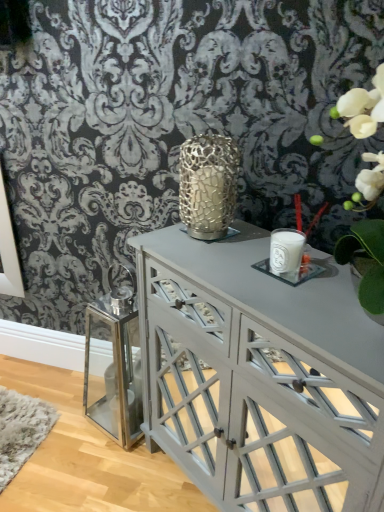
How much space does gold textured candle holder at center, arranged as the 2th candle holder when ordered from the bottom, occupy horizontally?

gold textured candle holder at center, arranged as the 2th candle holder when ordered from the bottom, is 6.56 inches in width.

In order to face white glass candle at center, the second candle holder positioned from the left, should I rotate leftwards or rightwards?

A 12.604 degree turn to the right will do.

The width and height of the screenshot is (384, 512). Describe the element at coordinates (288, 258) in the screenshot. I see `white glass candle at center, the second candle holder positioned from the left` at that location.

You are a GUI agent. You are given a task and a screenshot of the screen. Output one action in this format:
    pyautogui.click(x=<x>, y=<y>)
    Task: Click on the gold textured candle holder at center, arranged as the 2th candle holder when ordered from the bottom
    The height and width of the screenshot is (512, 384).
    Given the screenshot: What is the action you would take?
    pyautogui.click(x=208, y=185)

From a real-world perspective, is matte gray cabinet at center on white glass candle at center, the second candle holder positioned from the left?

No, from a real-world perspective, matte gray cabinet at center is not over white glass candle at center, the second candle holder positioned from the left

Locate an element on the screen. This screenshot has height=512, width=384. table located underneath the white glass candle at center, the 1th candle holder ordered from the bottom (from a real-world perspective) is located at coordinates (260, 375).

Considering the points (284, 386) and (277, 238), which point is behind, point (284, 386) or point (277, 238)?

The point (277, 238) is farther from the camera.

Is matte gray cabinet at center oriented away from white glass candle at center, marked as the 1th candle holder in a right-to-left arrangement?

matte gray cabinet at center is not turned away from white glass candle at center, marked as the 1th candle holder in a right-to-left arrangement.

How different are the orientations of white glass candle at center, the second candle holder positioned from the left, and matte gray cabinet at center in degrees?

There is a 3.14-degree angle between the facing directions of white glass candle at center, the second candle holder positioned from the left, and matte gray cabinet at center.

Is white glass candle at center, marked as the 2th candle holder in a top-to-bottom arrangement, placed right next to matte gray cabinet at center?

white glass candle at center, marked as the 2th candle holder in a top-to-bottom arrangement, and matte gray cabinet at center are not in contact.

Between white glass candle at center, the 1th candle holder ordered from the bottom, and matte gray cabinet at center, which one has larger size?

matte gray cabinet at center.

Is white glass candle at center, the second candle holder positioned from the left, situated inside matte gray cabinet at center or outside?

white glass candle at center, the second candle holder positioned from the left, is located beyond the bounds of matte gray cabinet at center.

In the scene shown: From the image's perspective, does gold textured candle holder at center, which is counted as the second candle holder, starting from the right, appear lower than matte gray cabinet at center?

No.

Considering the relative sizes of gold textured candle holder at center, marked as the 1th candle holder in a top-to-bottom arrangement, and matte gray cabinet at center in the image provided, is gold textured candle holder at center, marked as the 1th candle holder in a top-to-bottom arrangement, smaller than matte gray cabinet at center?

Yes.

Could you tell me if gold textured candle holder at center, which is counted as the second candle holder, starting from the right, is facing matte gray cabinet at center?

No, gold textured candle holder at center, which is counted as the second candle holder, starting from the right, is not oriented towards matte gray cabinet at center.

Which of these two, gold textured candle holder at center, marked as the 1th candle holder in a top-to-bottom arrangement, or matte gray cabinet at center, is wider?

Wider between the two is matte gray cabinet at center.

Can you confirm if white glass candle at center, the 1th candle holder ordered from the bottom, is positioned to the left of gold textured candle holder at center, arranged as the 2th candle holder when ordered from the bottom?

No.

Is white glass candle at center, the 1th candle holder ordered from the bottom, looking in the opposite direction of gold textured candle holder at center, which is counted as the second candle holder, starting from the right?

That's not correct — white glass candle at center, the 1th candle holder ordered from the bottom, is not looking away from gold textured candle holder at center, which is counted as the second candle holder, starting from the right.

Can you confirm if white glass candle at center, the second candle holder positioned from the left, is wider than gold textured candle holder at center, which is counted as the second candle holder, starting from the right?

No, white glass candle at center, the second candle holder positioned from the left, is not wider than gold textured candle holder at center, which is counted as the second candle holder, starting from the right.

Considering the points (293, 262) and (203, 193), which point is in front, point (293, 262) or point (203, 193)?

The point (293, 262) is more forward.

Does gold textured candle holder at center, acting as the first candle holder starting from the left, appear on the right side of white glass candle at center, the second candle holder positioned from the left?

No, gold textured candle holder at center, acting as the first candle holder starting from the left, is not to the right of white glass candle at center, the second candle holder positioned from the left.

From a real-world perspective, which object rests below the other?

white glass candle at center, the second candle holder positioned from the left, is physically lower.

Is point (186, 175) less distant than point (281, 276)?

No.

Is matte gray cabinet at center oriented towards gold textured candle holder at center, which is counted as the second candle holder, starting from the right?

No, matte gray cabinet at center is not oriented towards gold textured candle holder at center, which is counted as the second candle holder, starting from the right.

Is matte gray cabinet at center positioned far away from gold textured candle holder at center, marked as the 1th candle holder in a top-to-bottom arrangement?

They are positioned close to each other.

From a real-world perspective, who is located higher, matte gray cabinet at center or gold textured candle holder at center, which is counted as the second candle holder, starting from the right?

From a 3D spatial view, gold textured candle holder at center, which is counted as the second candle holder, starting from the right, is above.

From the image's perspective, is matte gray cabinet at center located above or below gold textured candle holder at center, marked as the 1th candle holder in a top-to-bottom arrangement?

matte gray cabinet at center is below gold textured candle holder at center, marked as the 1th candle holder in a top-to-bottom arrangement.

The height and width of the screenshot is (512, 384). What are the coordinates of `table directly beneath the white glass candle at center, the second candle holder positioned from the left (from a real-world perspective)` in the screenshot? It's located at (260, 375).

In order to click on the 1st candle holder behind the matte gray cabinet at center in this screenshot , I will do click(288, 258).

From the image, which object appears to be farther from matte gray cabinet at center, gold textured candle holder at center, arranged as the 2th candle holder when ordered from the bottom, or white glass candle at center, the 1th candle holder ordered from the bottom?

Among the two, gold textured candle holder at center, arranged as the 2th candle holder when ordered from the bottom, is located further to matte gray cabinet at center.

Looking at the image, which one is located further to gold textured candle holder at center, arranged as the 2th candle holder when ordered from the bottom, matte gray cabinet at center or white glass candle at center, marked as the 2th candle holder in a top-to-bottom arrangement?

The object further to gold textured candle holder at center, arranged as the 2th candle holder when ordered from the bottom, is matte gray cabinet at center.

Looking at this image, from the image, which object appears to be nearer to matte gray cabinet at center, white glass candle at center, marked as the 1th candle holder in a right-to-left arrangement, or gold textured candle holder at center, marked as the 1th candle holder in a top-to-bottom arrangement?

Based on the image, white glass candle at center, marked as the 1th candle holder in a right-to-left arrangement, appears to be nearer to matte gray cabinet at center.

When comparing their distances from white glass candle at center, marked as the 2th candle holder in a top-to-bottom arrangement, does matte gray cabinet at center or gold textured candle holder at center, arranged as the 2th candle holder when ordered from the bottom, seem further?

matte gray cabinet at center lies further to white glass candle at center, marked as the 2th candle holder in a top-to-bottom arrangement, than the other object.

Based on their spatial positions, is white glass candle at center, marked as the 1th candle holder in a right-to-left arrangement, or matte gray cabinet at center closer to gold textured candle holder at center, arranged as the 2th candle holder when ordered from the bottom?

white glass candle at center, marked as the 1th candle holder in a right-to-left arrangement, is positioned closer to the anchor gold textured candle holder at center, arranged as the 2th candle holder when ordered from the bottom.

When comparing their distances from white glass candle at center, marked as the 1th candle holder in a right-to-left arrangement, does gold textured candle holder at center, marked as the 1th candle holder in a top-to-bottom arrangement, or matte gray cabinet at center seem closer?

Among the two, gold textured candle holder at center, marked as the 1th candle holder in a top-to-bottom arrangement, is located nearer to white glass candle at center, marked as the 1th candle holder in a right-to-left arrangement.

This screenshot has height=512, width=384. I want to click on candle holder between gold textured candle holder at center, which is counted as the second candle holder, starting from the right, and matte gray cabinet at center vertically, so click(x=288, y=258).